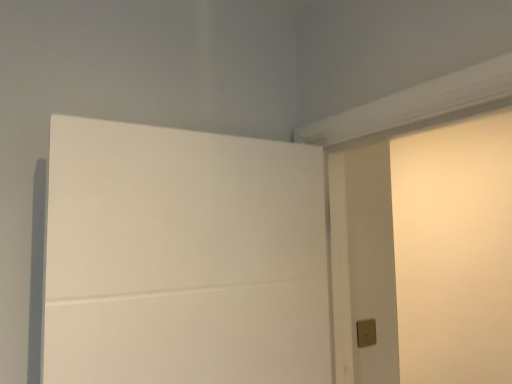
Question: Would you say white matte door at upper left is to the left or to the right of matte beige light switch at lower right in the picture?

Choices:
 (A) right
 (B) left

Answer: (B)

Question: From the image's perspective, is white matte door at upper left positioned above or below matte beige light switch at lower right?

Choices:
 (A) below
 (B) above

Answer: (B)

Question: From a real-world perspective, relative to matte beige light switch at lower right, is white matte door at upper left vertically above or below?

Choices:
 (A) above
 (B) below

Answer: (A)

Question: Is matte beige light switch at lower right wider or thinner than white matte door at upper left?

Choices:
 (A) thin
 (B) wide

Answer: (A)

Question: Considering the positions of matte beige light switch at lower right and white matte door at upper left in the image, is matte beige light switch at lower right taller or shorter than white matte door at upper left?

Choices:
 (A) short
 (B) tall

Answer: (A)

Question: Considering the positions of matte beige light switch at lower right and white matte door at upper left in the image, is matte beige light switch at lower right bigger or smaller than white matte door at upper left?

Choices:
 (A) small
 (B) big

Answer: (A)

Question: Is point (367, 322) positioned closer to the camera than point (243, 150)?

Choices:
 (A) farther
 (B) closer

Answer: (A)